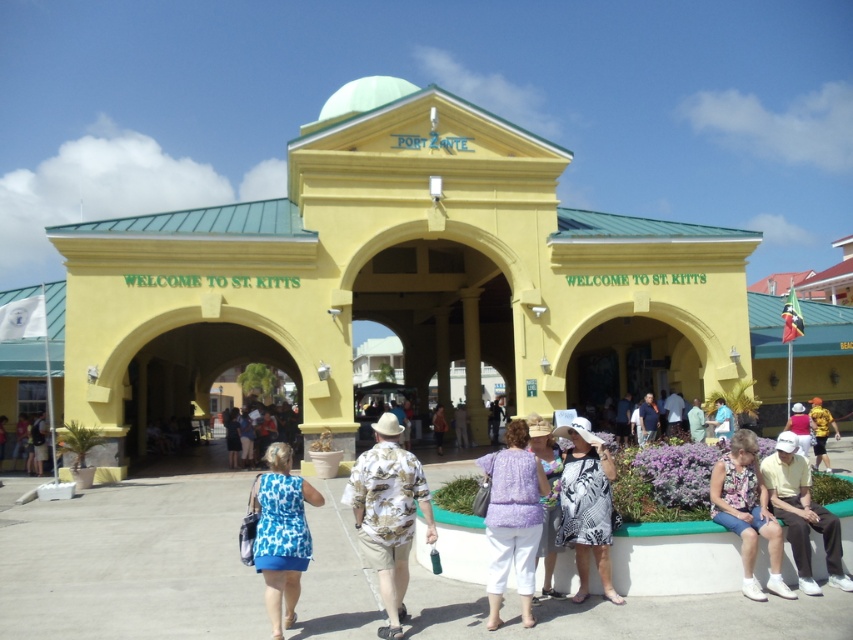
You are standing at the entrance of Port Zante and notice a yellow matte building at center and a brown leather jacket at center. Which object is closer to you?

The brown leather jacket at center is closer to you because the yellow matte building at center is positioned over it, indicating the jacket is in front.

Looking at this image, you are standing at the entrance of Port Zante and want to take a photo of the yellow matte building at center. Where should you position yourself to capture the building in the center of your camera frame?

To capture the yellow matte building at center in the center of your camera frame, position yourself directly in front of it, aligning the building with the frame using its coordinates at point (399, 282).